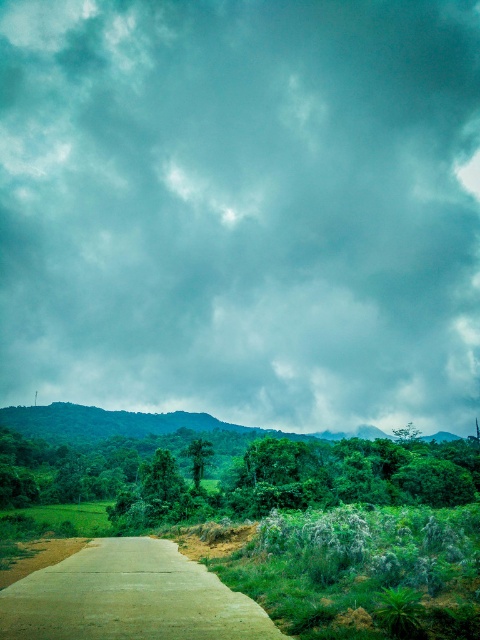
Question: Which point is closer to the camera taking this photo?

Choices:
 (A) (264, 468)
 (B) (255, 396)
 (C) (375, 435)
 (D) (206, 582)

Answer: (D)

Question: Considering the relative positions of concrete road at center and green leafy mountain at center in the image provided, where is concrete road at center located with respect to green leafy mountain at center?

Choices:
 (A) right
 (B) left

Answer: (B)

Question: Which point is closer to the camera taking this photo?

Choices:
 (A) (83, 476)
 (B) (444, 177)
 (C) (76, 609)

Answer: (C)

Question: Does concrete road at center have a smaller size compared to green leafy mountain at center?

Choices:
 (A) yes
 (B) no

Answer: (A)

Question: Does gray cloudy sky at upper center have a greater width compared to green leafy trees at center?

Choices:
 (A) yes
 (B) no

Answer: (A)

Question: Considering the real-world distances, which object is farthest from the concrete road at center?

Choices:
 (A) gray cloudy sky at upper center
 (B) green leafy trees at center

Answer: (A)